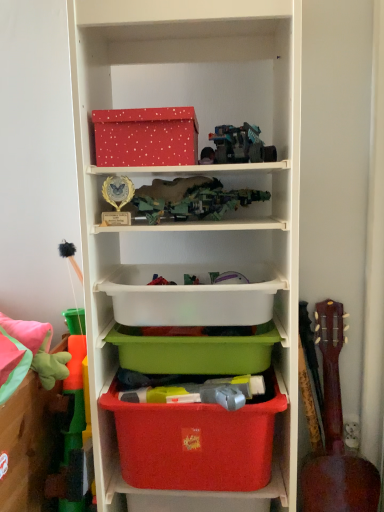
The image size is (384, 512). What do you see at coordinates (196, 442) in the screenshot?
I see `matte plastic storage box at lower center, the 1th storage box positioned from the bottom` at bounding box center [196, 442].

Identify the location of green plastic container at center, which is the 3th storage box from bottom to top. The width and height of the screenshot is (384, 512). (195, 352).

What is the approximate width of green plastic container at center, which is the 3th storage box from bottom to top?

It is 13.17 inches.

What is the approximate width of red dotted cardboard box at upper center?

18.17 centimeters.

Locate an element on the screen. The width and height of the screenshot is (384, 512). red dotted cardboard box at upper center is located at coordinates (146, 137).

This screenshot has width=384, height=512. What do you see at coordinates (336, 434) in the screenshot?
I see `brown wooden guitar at right` at bounding box center [336, 434].

This screenshot has width=384, height=512. Find the location of `teal plastic toy truck at upper center, arranged as the second toy when ordered from the bottom`. teal plastic toy truck at upper center, arranged as the second toy when ordered from the bottom is located at coordinates point(240,145).

Measure the distance between matte plastic shelf at center and camera.

matte plastic shelf at center and camera are 32.68 inches apart.

Locate an element on the screen. The width and height of the screenshot is (384, 512). matte plastic storage box at left, the second storage box positioned from the bottom is located at coordinates (29, 446).

Considering the sizes of green plastic container at center, which ranks as the second storage box in top-to-bottom order, and brown wooden guitar at right in the image, is green plastic container at center, which ranks as the second storage box in top-to-bottom order, bigger or smaller than brown wooden guitar at right?

Clearly, green plastic container at center, which ranks as the second storage box in top-to-bottom order, is smaller in size than brown wooden guitar at right.

Is green plastic container at center, which is the 3th storage box from bottom to top, facing towards brown wooden guitar at right?

No, green plastic container at center, which is the 3th storage box from bottom to top, is not facing towards brown wooden guitar at right.

From a real-world perspective, is green plastic container at center, which is the 3th storage box from bottom to top, below brown wooden guitar at right?

No, from a real-world perspective, green plastic container at center, which is the 3th storage box from bottom to top, is not under brown wooden guitar at right.

Identify the location of box located behind the white plastic container at center, which is the 1th storage box in top-to-bottom order. (146, 137).

Is point (133, 131) behind point (237, 266)?

No, (133, 131) is in front of (237, 266).

Who is smaller, red dotted cardboard box at upper center or white plastic container at center, which is the 1th storage box in top-to-bottom order?

Smaller between the two is red dotted cardboard box at upper center.

Considering the relative sizes of red dotted cardboard box at upper center and white plastic container at center, which is the 1th storage box in top-to-bottom order, in the image provided, is red dotted cardboard box at upper center taller than white plastic container at center, which is the 1th storage box in top-to-bottom order,?

In fact, red dotted cardboard box at upper center may be shorter than white plastic container at center, which is the 1th storage box in top-to-bottom order.

From a real-world perspective, is teal plastic toy truck at upper center, which is counted as the second toy, starting from the back, on top of green plastic container at center, which is the 3th storage box from bottom to top?

Yes, from a real-world perspective, teal plastic toy truck at upper center, which is counted as the second toy, starting from the back, is on top of green plastic container at center, which is the 3th storage box from bottom to top.

What's the angular difference between teal plastic toy truck at upper center, which is counted as the second toy, starting from the back, and green plastic container at center, which is the 3th storage box from bottom to top,'s facing directions?

teal plastic toy truck at upper center, which is counted as the second toy, starting from the back, and green plastic container at center, which is the 3th storage box from bottom to top, are facing 2.71 degrees away from each other.

Is teal plastic toy truck at upper center, the 1th toy in the front-to-back sequence, positioned with its back to green plastic container at center, which ranks as the second storage box in top-to-bottom order?

No, teal plastic toy truck at upper center, the 1th toy in the front-to-back sequence, is not facing away from green plastic container at center, which ranks as the second storage box in top-to-bottom order.

Which object is positioned more to the right, teal plastic toy truck at upper center, the 1th toy in the front-to-back sequence, or green plastic container at center, which ranks as the second storage box in top-to-bottom order?

teal plastic toy truck at upper center, the 1th toy in the front-to-back sequence.

Is matte plastic storage box at lower center, which is counted as the fourth storage box, starting from the top, touching white plastic container at center, which is the 4th storage box from bottom to top?

No, matte plastic storage box at lower center, which is counted as the fourth storage box, starting from the top, is not in contact with white plastic container at center, which is the 4th storage box from bottom to top.

From the image's perspective, does matte plastic storage box at lower center, which is counted as the fourth storage box, starting from the top, appear lower than white plastic container at center, which is the 4th storage box from bottom to top?

Yes.

Considering the sizes of objects matte plastic storage box at lower center, which is counted as the fourth storage box, starting from the top, and white plastic container at center, which is the 4th storage box from bottom to top, in the image provided, who is thinner, matte plastic storage box at lower center, which is counted as the fourth storage box, starting from the top, or white plastic container at center, which is the 4th storage box from bottom to top,?

matte plastic storage box at lower center, which is counted as the fourth storage box, starting from the top, is thinner.

Find the location of `storage box that is the 1st one when counting forward from the white plastic container at center, which is the 1th storage box in top-to-bottom order`. storage box that is the 1st one when counting forward from the white plastic container at center, which is the 1th storage box in top-to-bottom order is located at coordinates (196, 442).

Consider the image. Would you consider white plastic container at center, which is the 1th storage box in top-to-bottom order, to be distant from teal plastic toy truck at upper center, the 1th toy in the front-to-back sequence?

white plastic container at center, which is the 1th storage box in top-to-bottom order, is near teal plastic toy truck at upper center, the 1th toy in the front-to-back sequence, not far away.

Is white plastic container at center, which is the 1th storage box in top-to-bottom order, positioned beyond the bounds of teal plastic toy truck at upper center, the 1th toy from the right?

Yes.

Is white plastic container at center, which is the 4th storage box from bottom to top, facing away from teal plastic toy truck at upper center, positioned as the first toy in top-to-bottom order?

That's not correct — white plastic container at center, which is the 4th storage box from bottom to top, is not looking away from teal plastic toy truck at upper center, positioned as the first toy in top-to-bottom order.

Which of these two, white plastic container at center, which is the 1th storage box in top-to-bottom order, or teal plastic toy truck at upper center, marked as the second toy in a left-to-right arrangement, stands taller?

Standing taller between the two is white plastic container at center, which is the 1th storage box in top-to-bottom order.

Find the location of `shelf that appears on the left of brown wooden guitar at right`. shelf that appears on the left of brown wooden guitar at right is located at coordinates (191, 173).

Is brown wooden guitar at right in contact with matte plastic shelf at center?

No, brown wooden guitar at right is not in contact with matte plastic shelf at center.

Considering the sizes of brown wooden guitar at right and matte plastic shelf at center in the image, is brown wooden guitar at right taller or shorter than matte plastic shelf at center?

Considering their sizes, brown wooden guitar at right has less height than matte plastic shelf at center.

From the image's perspective, is brown wooden guitar at right over matte plastic shelf at center?

No, from the image's perspective, brown wooden guitar at right is not above matte plastic shelf at center.

Which is more to the right, teal plastic toy truck at upper center, arranged as the second toy when ordered from the bottom, or white plastic container at center, which is the 4th storage box from bottom to top?

teal plastic toy truck at upper center, arranged as the second toy when ordered from the bottom, is more to the right.

Would you say teal plastic toy truck at upper center, the 1th toy in the front-to-back sequence, is inside or outside white plastic container at center, which is the 4th storage box from bottom to top?

teal plastic toy truck at upper center, the 1th toy in the front-to-back sequence, cannot be found inside white plastic container at center, which is the 4th storage box from bottom to top.

From a real-world perspective, does teal plastic toy truck at upper center, which is counted as the second toy, starting from the back, sit lower than white plastic container at center, which is the 1th storage box in top-to-bottom order?

No, from a real-world perspective, teal plastic toy truck at upper center, which is counted as the second toy, starting from the back, is not beneath white plastic container at center, which is the 1th storage box in top-to-bottom order.

In the scene shown: Measure the distance between teal plastic toy truck at upper center, the 1th toy in the front-to-back sequence, and white plastic container at center, which is the 1th storage box in top-to-bottom order.

teal plastic toy truck at upper center, the 1th toy in the front-to-back sequence, and white plastic container at center, which is the 1th storage box in top-to-bottom order, are 13.44 inches apart from each other.

I want to click on guitar in front of the green plastic container at center, which is the 3th storage box from bottom to top, so click(x=336, y=434).

From the image's perspective, which storage box is the 1st one below the red dotted cardboard box at upper center? Please provide its 2D coordinates.

[(191, 296)]

Estimate the real-world distances between objects in this image. Which object is further from red dotted cardboard box at upper center, matte plastic shelf at center or brown wooden guitar at right?

brown wooden guitar at right is further to red dotted cardboard box at upper center.

From the picture: Based on their spatial positions, is white plastic container at center, which is the 4th storage box from bottom to top, or matte plastic shelf at center further from green plastic toy at left, which is the second toy from top to bottom?

The object further to green plastic toy at left, which is the second toy from top to bottom, is matte plastic shelf at center.

Looking at this image, which object lies further to the anchor point brown wooden guitar at right, matte plastic storage box at left, the second storage box positioned from the bottom, or matte plastic shelf at center?

The object further to brown wooden guitar at right is matte plastic storage box at left, the second storage box positioned from the bottom.

Estimate the real-world distances between objects in this image. Which object is closer to green plastic toy at left, the 2th toy in the front-to-back sequence, matte plastic shelf at center or white plastic container at center, which is the 1th storage box in top-to-bottom order?

white plastic container at center, which is the 1th storage box in top-to-bottom order, is closer to green plastic toy at left, the 2th toy in the front-to-back sequence.

Looking at the image, which one is located closer to matte plastic shelf at center, white plastic container at center, which is the 4th storage box from bottom to top, or green plastic container at center, which ranks as the second storage box in top-to-bottom order?

white plastic container at center, which is the 4th storage box from bottom to top, is positioned closer to the anchor matte plastic shelf at center.

In the scene shown: Considering their positions, is red dotted cardboard box at upper center positioned further to matte plastic storage box at lower center, which is counted as the fourth storage box, starting from the top, than matte plastic storage box at left, the second storage box positioned from the bottom?

Among the two, red dotted cardboard box at upper center is located further to matte plastic storage box at lower center, which is counted as the fourth storage box, starting from the top.

Considering their positions, is matte plastic storage box at lower center, which is counted as the fourth storage box, starting from the top, positioned further to matte plastic storage box at left, the third storage box positioned from the top, than teal plastic toy truck at upper center, the 1th toy from the right?

teal plastic toy truck at upper center, the 1th toy from the right.

Considering their positions, is matte plastic storage box at left, the third storage box positioned from the top, positioned closer to green plastic container at center, which ranks as the second storage box in top-to-bottom order, than matte plastic storage box at lower center, the 1th storage box positioned from the bottom?

The object closer to green plastic container at center, which ranks as the second storage box in top-to-bottom order, is matte plastic storage box at lower center, the 1th storage box positioned from the bottom.

You are a GUI agent. You are given a task and a screenshot of the screen. Output one action in this format:
    pyautogui.click(x=<x>, y=<y>)
    Task: Click on the storage box between red dotted cardboard box at upper center and matte plastic shelf at center from top to bottom
    This screenshot has height=512, width=384.
    Given the screenshot: What is the action you would take?
    [191, 296]

Image resolution: width=384 pixels, height=512 pixels. In order to click on shelf that lies between red dotted cardboard box at upper center and green plastic toy at left, the 2th toy in the front-to-back sequence, from top to bottom in this screenshot , I will do `click(191, 173)`.

At what (x,y) coordinates should I click in order to perform the action: click on shelf between red dotted cardboard box at upper center and matte plastic storage box at lower center, the 1th storage box positioned from the bottom, in the up-down direction. Please return your answer as a coordinate pair (x, y). The width and height of the screenshot is (384, 512). Looking at the image, I should click on (191, 173).

The width and height of the screenshot is (384, 512). In order to click on toy between red dotted cardboard box at upper center and green plastic container at center, which ranks as the second storage box in top-to-bottom order, in the vertical direction in this screenshot , I will do `click(240, 145)`.